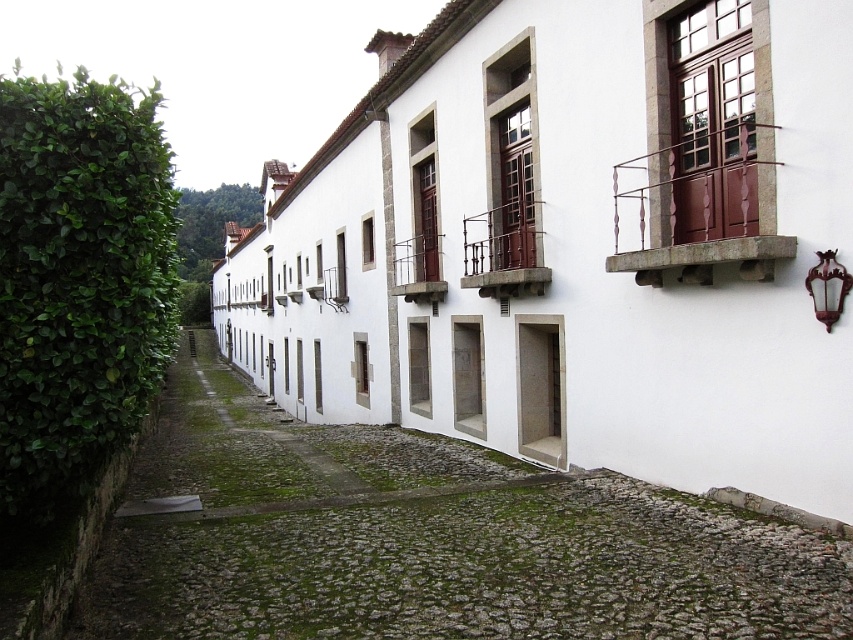
Which is in front, point (225, 529) or point (518, 273)?

Positioned in front is point (225, 529).

Is green cobblestone alley at center to the left of rustic wood balcony at center from the viewer's perspective?

Yes, green cobblestone alley at center is to the left of rustic wood balcony at center.

In the scene shown: Who is more forward, (732,566) or (497,289)?

Positioned in front is point (732,566).

Identify the location of green cobblestone alley at center. (427, 540).

Which is below, green cobblestone alley at center or brown wooden balcony at center?

green cobblestone alley at center

Does green cobblestone alley at center appear on the right side of brown wooden balcony at center?

In fact, green cobblestone alley at center is to the left of brown wooden balcony at center.

Where is `green cobblestone alley at center`? green cobblestone alley at center is located at coordinates (427, 540).

Locate an element on the screen. This screenshot has width=853, height=640. green cobblestone alley at center is located at coordinates (427, 540).

Who is higher up, rustic wood balcony at center or brown wooden balcony at center?

Positioned higher is brown wooden balcony at center.

In order to click on rustic wood balcony at center in this screenshot , I will do `click(503, 252)`.